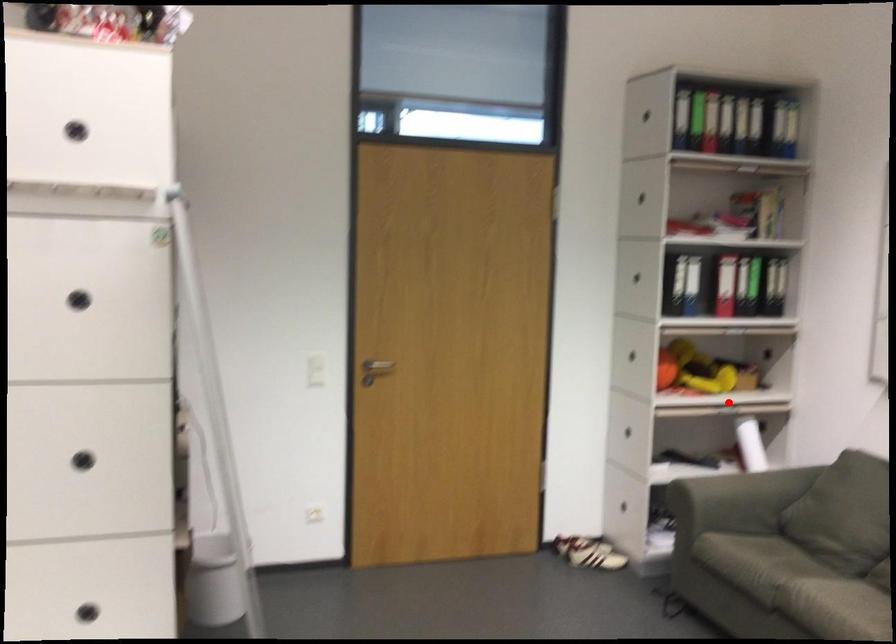
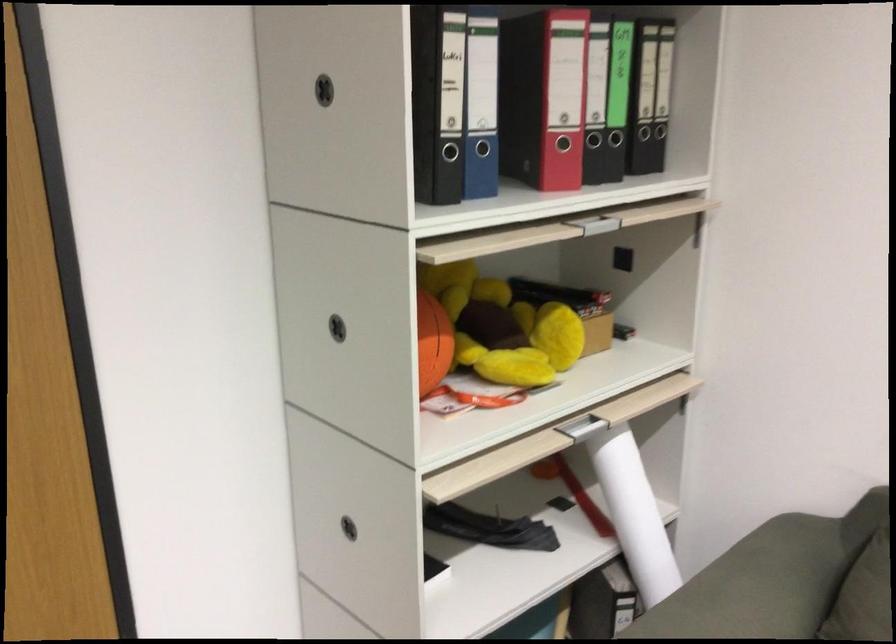
Question: A red point is marked in image1. In image2, is the corresponding 3D point closer to the camera or farther? Reply with the corresponding letter.

Choices:
 (A) The corresponding 3D point is closer.
 (B) The corresponding 3D point is farther.

Answer: (A)